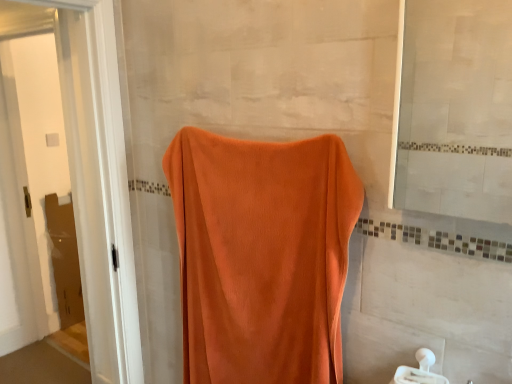
Question: Is orange velvety towel at center in front of or behind orange towel at left in the image?

Choices:
 (A) front
 (B) behind

Answer: (A)

Question: Does point (202, 150) appear closer or farther from the camera than point (70, 152)?

Choices:
 (A) closer
 (B) farther

Answer: (A)

Question: Which is nearer to the orange velvety towel at center?

Choices:
 (A) matte glass mirror at upper right
 (B) white plastic towel bar at lower right
 (C) orange towel at left

Answer: (A)

Question: Considering the real-world distances, which object is closest to the matte glass mirror at upper right?

Choices:
 (A) orange towel at left
 (B) white plastic towel bar at lower right
 (C) orange velvety towel at center

Answer: (C)